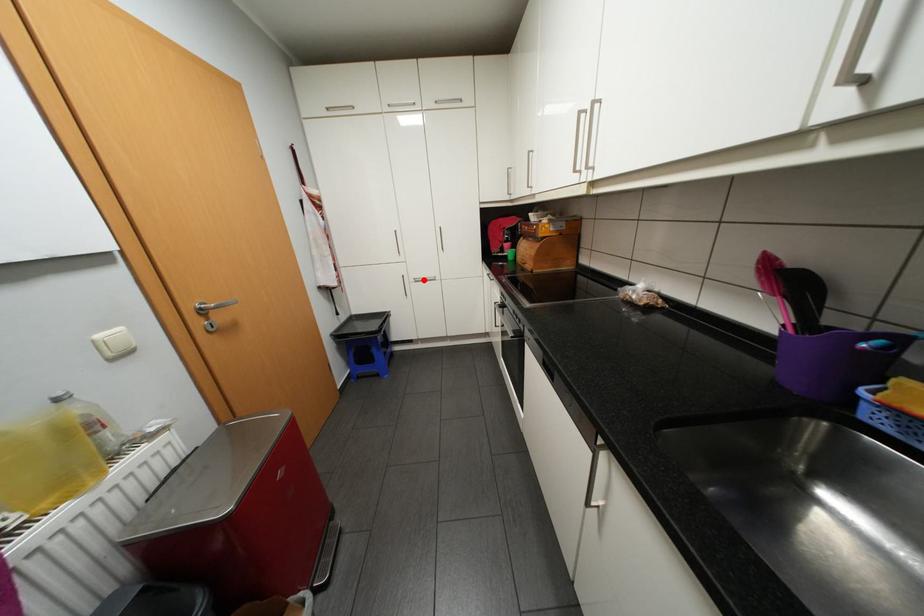
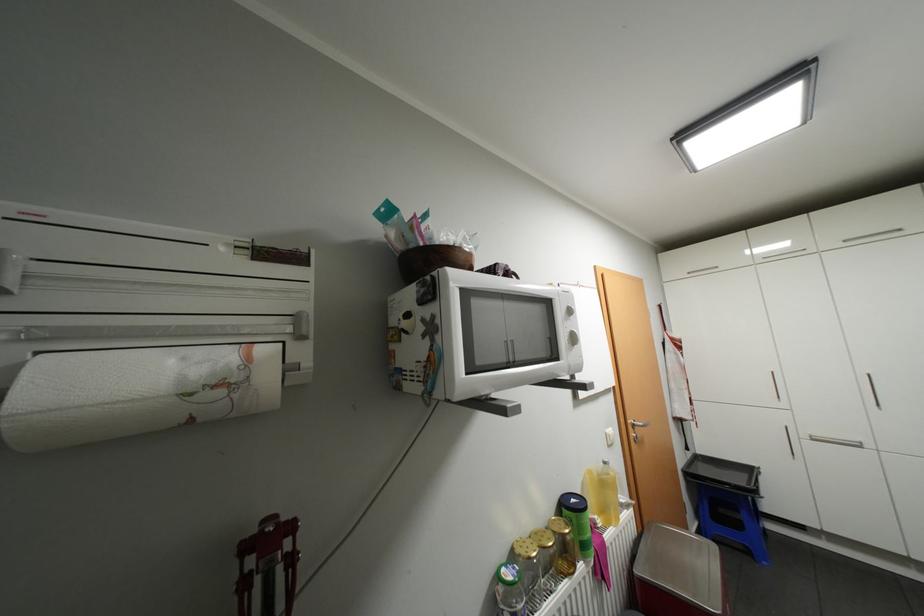
In the second image, find the point that corresponds to the highlighted location in the first image.

(821, 438)